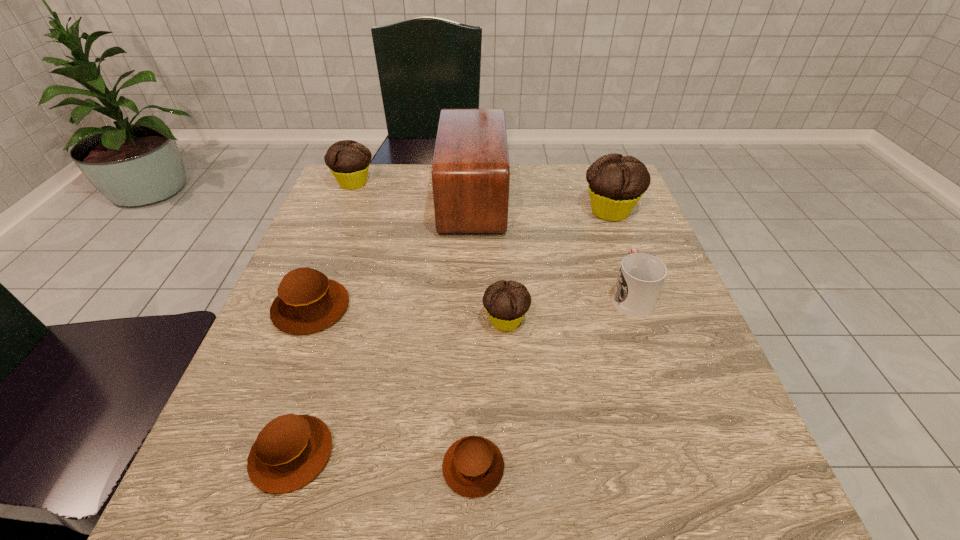
Find the location of a particular element. This screenshot has width=960, height=540. unoccupied position between the radio receiver and the shortest muffin is located at coordinates (473, 333).

The image size is (960, 540). I want to click on free area in between the nearest chocolate muffin and the second shortest muffin, so click(x=398, y=387).

Locate an element on the screen. blank region between the radio receiver and the fifth tallest muffin is located at coordinates (382, 326).

You are a GUI agent. You are given a task and a screenshot of the screen. Output one action in this format:
    pyautogui.click(x=<x>, y=<y>)
    Task: Click on the free space that is in between the radio receiver and the biggest brown muffin
    
    Given the screenshot: What is the action you would take?
    pyautogui.click(x=392, y=253)

Find the location of a particular element. Image resolution: width=960 pixels, height=540 pixels. vacant area that lies between the rightmost brown muffin and the nearest chocolate muffin is located at coordinates (490, 394).

This screenshot has height=540, width=960. I want to click on object that is the fourth closest to the tallest object, so 307,302.

Where is `object that stands as the seventh closest to the third tallest object`? This screenshot has width=960, height=540. object that stands as the seventh closest to the third tallest object is located at coordinates (473, 466).

Locate an element on the screen. The height and width of the screenshot is (540, 960). muffin that is the fifth closest one to the biggest chocolate muffin is located at coordinates [290, 451].

You are a GUI agent. You are given a task and a screenshot of the screen. Output one action in this format:
    pyautogui.click(x=<x>, y=<y>)
    Task: Click on the third closest muffin to the biggest brown muffin
    Image resolution: width=960 pixels, height=540 pixels.
    Given the screenshot: What is the action you would take?
    pyautogui.click(x=473, y=466)

The height and width of the screenshot is (540, 960). I want to click on the second closest chocolate muffin to the biggest brown muffin, so click(348, 160).